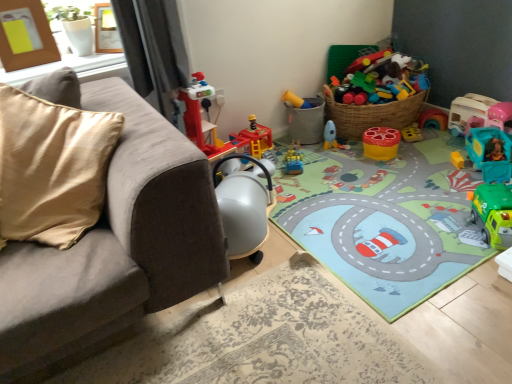
Question: Looking at their shapes, would you say teal plastic toy car at right, placed as the fifth toy when sorted from left to right, is wider or thinner than yellow matte stool at center, arranged as the 3th toy when viewed from the left?

Choices:
 (A) thin
 (B) wide

Answer: (B)

Question: Is teal plastic toy car at right, placed as the second toy when sorted from right to left, spatially inside yellow matte stool at center, placed as the fourth toy when sorted from right to left, or outside of it?

Choices:
 (A) inside
 (B) outside

Answer: (B)

Question: Which is nearer to the shiny yellow plastic train at center, which appears as the first toy when viewed from the left?

Choices:
 (A) matte plastic bucket at center, the 5th toy when ordered from right to left
 (B) carpeted play mat at center
 (C) yellow matte stool at center, arranged as the 3th toy when viewed from the left
 (D) suede gray couch at left
 (E) wooden photo frame at upper center, positioned as the first picture frame in right-to-left order

Answer: (A)

Question: Based on their relative distances, which object is farther from the teal plastic toy car at right, placed as the fifth toy when sorted from left to right?

Choices:
 (A) matte plastic bucket at center, marked as the 2th toy in a left-to-right arrangement
 (B) brown wooden picture frame at upper left, the 1th picture frame from the left
 (C) teal plastic toy car at right, arranged as the 6th toy when viewed from the left
 (D) wooden photo frame at upper center, positioned as the 2th picture frame in left-to-right order
 (E) suede gray couch at left

Answer: (B)